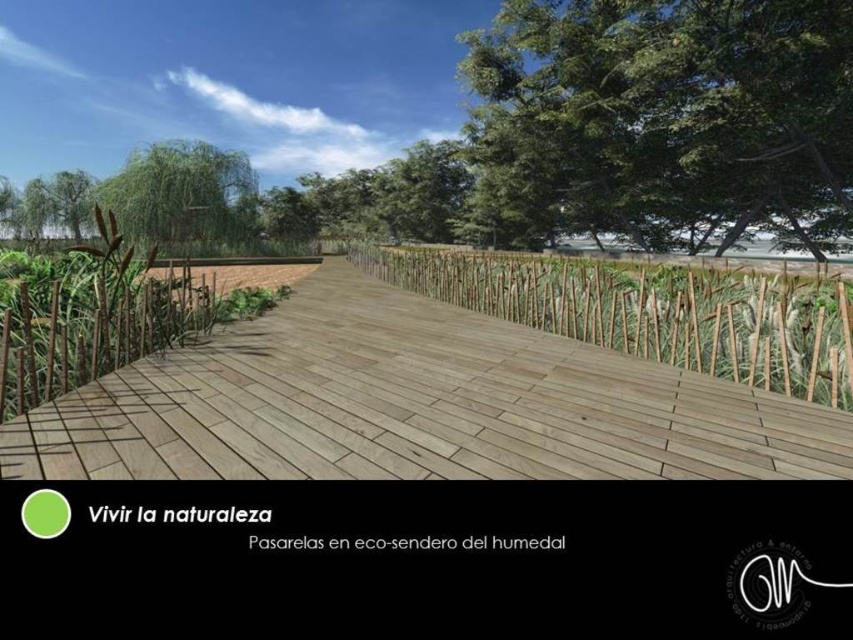
Question: Considering the relative positions of wooden at center and green leafy tree at upper left in the image provided, where is wooden at center located with respect to green leafy tree at upper left?

Choices:
 (A) right
 (B) left

Answer: (A)

Question: Which of the following is the farthest from the observer?

Choices:
 (A) wooden at center
 (B) brown textured reed at left
 (C) natural bamboo fence at center

Answer: (C)

Question: Estimate the real-world distances between objects in this image. Which object is closer to the green leafy tree at upper right?

Choices:
 (A) wooden at center
 (B) natural bamboo fence at center
 (C) green leafy tree at upper left
 (D) brown textured reed at left

Answer: (B)

Question: Is wooden at center to the left of green leafy tree at upper right from the viewer's perspective?

Choices:
 (A) yes
 (B) no

Answer: (A)

Question: Which object is positioned farthest from the wooden at center?

Choices:
 (A) green leafy tree at upper left
 (B) natural bamboo fence at center

Answer: (A)

Question: Can you confirm if wooden at center is bigger than green leafy tree at upper right?

Choices:
 (A) no
 (B) yes

Answer: (A)